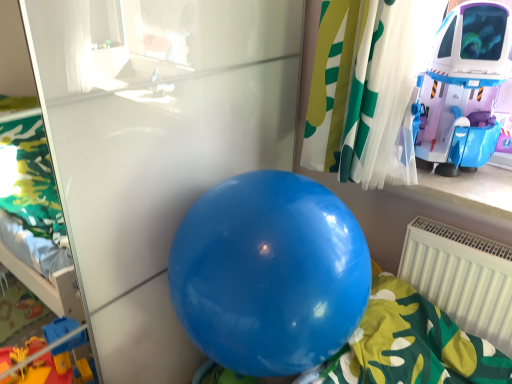
Question: From the image's perspective, is glossy blue balloon at center above white plastic radiator at lower right?

Choices:
 (A) yes
 (B) no

Answer: (A)

Question: Is glossy blue balloon at center thinner than white plastic radiator at lower right?

Choices:
 (A) yes
 (B) no

Answer: (B)

Question: Does glossy blue balloon at center contain white plastic radiator at lower right?

Choices:
 (A) yes
 (B) no

Answer: (B)

Question: Considering the relative positions of glossy blue balloon at center and white plastic radiator at lower right in the image provided, is glossy blue balloon at center to the left of white plastic radiator at lower right from the viewer's perspective?

Choices:
 (A) yes
 (B) no

Answer: (A)

Question: Does glossy blue balloon at center appear on the right side of white plastic radiator at lower right?

Choices:
 (A) no
 (B) yes

Answer: (A)

Question: Looking at the image, does shiny plastic spaceship at upper right seem bigger or smaller compared to white plastic radiator at lower right?

Choices:
 (A) small
 (B) big

Answer: (B)

Question: Relative to white plastic radiator at lower right, is shiny plastic spaceship at upper right in front or behind?

Choices:
 (A) front
 (B) behind

Answer: (A)

Question: From the image's perspective, is shiny plastic spaceship at upper right located above or below white plastic radiator at lower right?

Choices:
 (A) below
 (B) above

Answer: (B)

Question: Choose the correct answer: Is shiny plastic spaceship at upper right inside white plastic radiator at lower right or outside it?

Choices:
 (A) inside
 (B) outside

Answer: (B)

Question: Considering their positions, is glossy blue balloon at center located in front of or behind white plastic radiator at lower right?

Choices:
 (A) behind
 (B) front

Answer: (B)

Question: From a real-world perspective, is glossy blue balloon at center physically located above or below white plastic radiator at lower right?

Choices:
 (A) below
 (B) above

Answer: (B)

Question: Is glossy blue balloon at center bigger or smaller than white plastic radiator at lower right?

Choices:
 (A) small
 (B) big

Answer: (B)

Question: Is glossy blue balloon at center spatially inside white plastic radiator at lower right, or outside of it?

Choices:
 (A) outside
 (B) inside

Answer: (A)

Question: From the image's perspective, relative to glossy blue balloon at center, is white plastic radiator at lower right above or below?

Choices:
 (A) above
 (B) below

Answer: (B)

Question: From a real-world perspective, relative to glossy blue balloon at center, is white plastic radiator at lower right vertically above or below?

Choices:
 (A) below
 (B) above

Answer: (A)